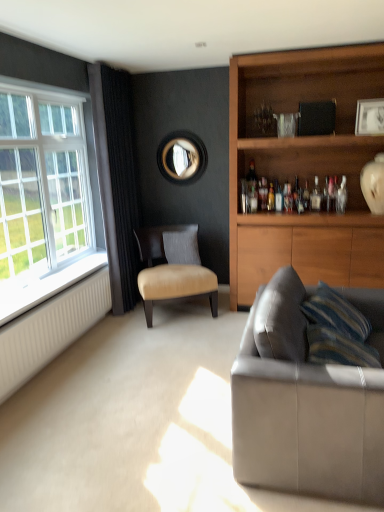
Question: From the image's perspective, is black velvet curtain at left located above translucent glass bottle at shelf center, the first bottle positioned from the back?

Choices:
 (A) yes
 (B) no

Answer: (A)

Question: Considering the relative sizes of black velvet curtain at left and translucent glass bottle at shelf center, which is the 1th bottle in left-to-right order, in the image provided, is black velvet curtain at left taller than translucent glass bottle at shelf center, which is the 1th bottle in left-to-right order,?

Choices:
 (A) no
 (B) yes

Answer: (B)

Question: Can you confirm if black velvet curtain at left is thinner than translucent glass bottle at shelf center, the first bottle positioned from the back?

Choices:
 (A) no
 (B) yes

Answer: (A)

Question: Does black velvet curtain at left turn towards translucent glass bottle at shelf center, the second bottle from the right?

Choices:
 (A) no
 (B) yes

Answer: (B)

Question: Is black velvet curtain at left further to camera compared to translucent glass bottle at shelf center, acting as the 2th bottle starting from the front?

Choices:
 (A) no
 (B) yes

Answer: (A)

Question: Does black velvet curtain at left appear on the left side of translucent glass bottle at shelf center, the first bottle positioned from the back?

Choices:
 (A) yes
 (B) no

Answer: (A)

Question: Does clear glass bottle at upper right, which is the 1th bottle from front to back, come in front of white ribbed radiator at lower left?

Choices:
 (A) yes
 (B) no

Answer: (B)

Question: Is clear glass bottle at upper right, which is the 1th bottle from front to back, beside white ribbed radiator at lower left?

Choices:
 (A) yes
 (B) no

Answer: (B)

Question: Is clear glass bottle at upper right, which is counted as the first bottle, starting from the right, shorter than white ribbed radiator at lower left?

Choices:
 (A) yes
 (B) no

Answer: (A)

Question: Is clear glass bottle at upper right, placed as the 2th bottle when sorted from back to front, not inside white ribbed radiator at lower left?

Choices:
 (A) yes
 (B) no

Answer: (A)

Question: Considering the relative positions of clear glass bottle at upper right, placed as the 2th bottle when sorted from back to front, and white ribbed radiator at lower left in the image provided, is clear glass bottle at upper right, placed as the 2th bottle when sorted from back to front, to the left of white ribbed radiator at lower left from the viewer's perspective?

Choices:
 (A) no
 (B) yes

Answer: (A)

Question: From a real-world perspective, is clear glass bottle at upper right, which is counted as the first bottle, starting from the right, physically below white ribbed radiator at lower left?

Choices:
 (A) yes
 (B) no

Answer: (B)

Question: Is white plastic window at left outside leather couch at lower right?

Choices:
 (A) yes
 (B) no

Answer: (A)